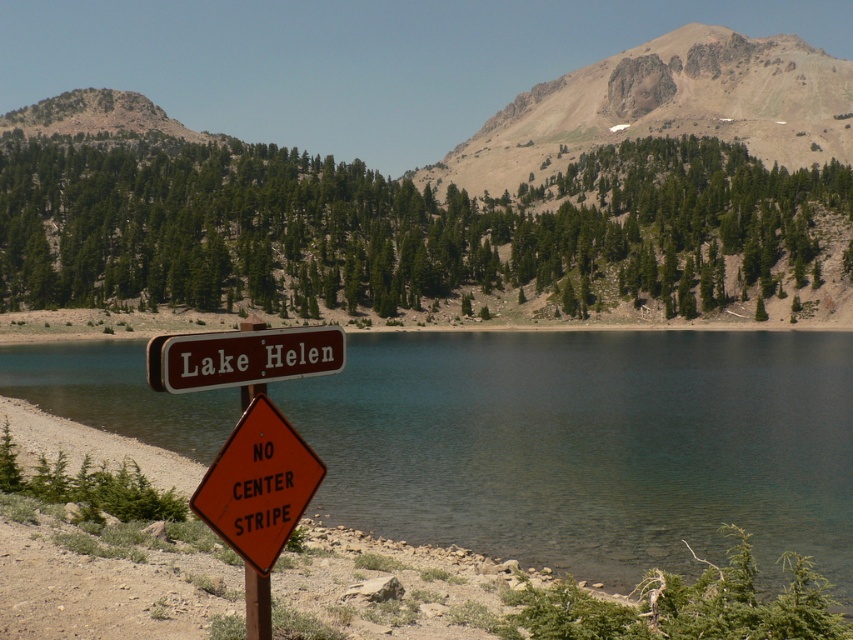
You are a hiker approaching the lake and see the brown wooden sign at center and the metallic pole at center. Which object is positioned higher in the scene?

The brown wooden sign at center is located above the metallic pole at center, so it is positioned higher in the scene.

You are standing at the base of the brown rocky mountain at upper center. If you want to reach the highest point of the mountain, which direction should you move relative to your current position?

You should move towards the upper center direction from your current position at the base of the brown rocky mountain at upper center to reach the highest point.